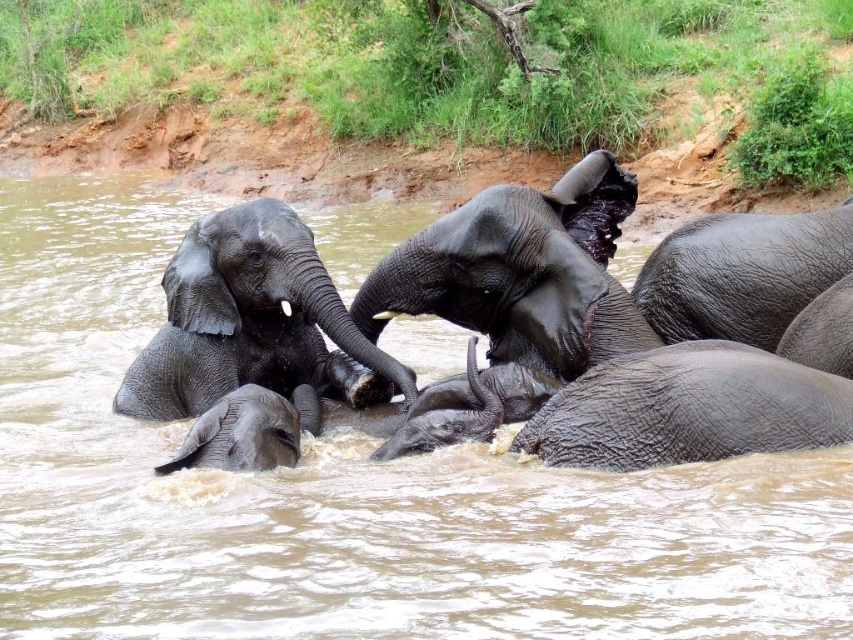
You are observing elephants in a muddy river. There is a shiny dark gray elephant at center and a gray textured baby elephant at lower left. Which elephant is positioned higher in the image?

The shiny dark gray elephant at center is positioned higher than the gray textured baby elephant at lower left in the image.

You are observing elephants at a watering hole. There is a shiny gray elephant at center and a wet gray elephant at lower right. From the perspective of someone standing at the edge of the water, which elephant is closer to the left side?

The shiny gray elephant at center is to the left of the wet gray elephant at lower right, so it is closer to the left side.